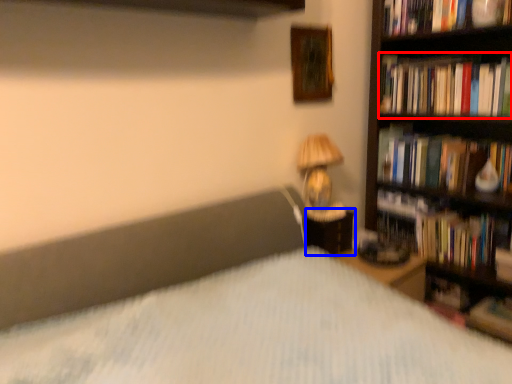
Question: Which of the following is the farthest to the observer, book (highlighted by a red box) or nightstand (highlighted by a blue box)?

Choices:
 (A) book
 (B) nightstand

Answer: (B)